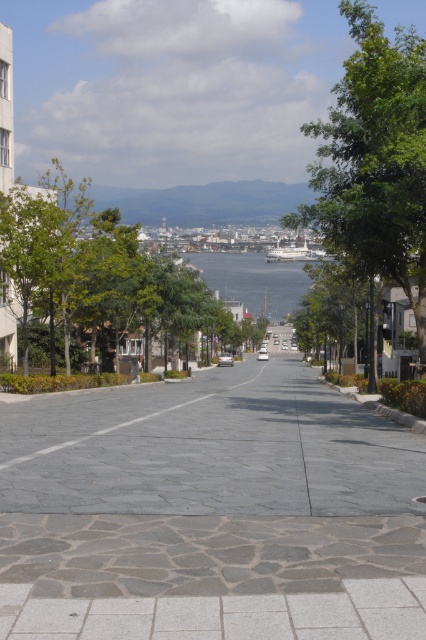
Question: From the image, what is the correct spatial relationship of gray stone pavement at center in relation to blue water at center?

Choices:
 (A) above
 (B) below

Answer: (B)

Question: Can you confirm if green leafy tree at right is positioned below gray stone road at center?

Choices:
 (A) yes
 (B) no

Answer: (B)

Question: Which of these objects is positioned closest to the green leafy tree at center?

Choices:
 (A) gray stone road at center
 (B) green leafy tree at right
 (C) blue water at center
 (D) gray stone pavement at center

Answer: (D)

Question: Does green leafy tree at right appear under green leafy tree at center?

Choices:
 (A) yes
 (B) no

Answer: (B)

Question: Which object is closer to the camera taking this photo?

Choices:
 (A) blue water at center
 (B) gray stone pavement at center
 (C) green leafy tree at center
 (D) green leafy tree at right

Answer: (B)

Question: Which object is positioned farthest from the blue water at center?

Choices:
 (A) gray stone pavement at center
 (B) green leafy tree at right
 (C) green leafy tree at center
 (D) gray stone road at center

Answer: (A)